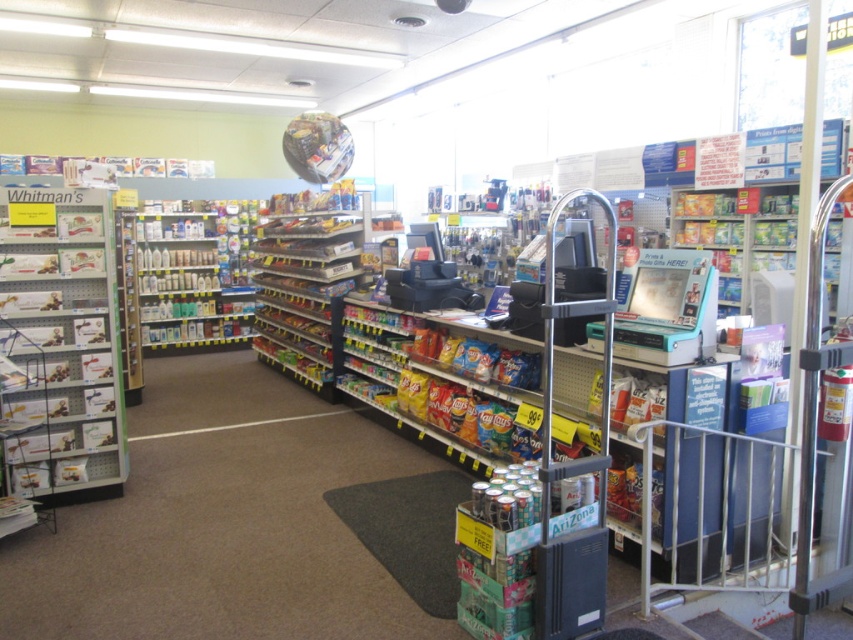
You are a customer in the store and want to place a metallic silver candy at left and a white plastic bottles at left into your shopping basket. Which item will require a wider space in the basket?

The white plastic bottles at left require a wider space in the basket because they have a greater width than the metallic silver candy at left.

You are a customer in the store and want to pick up both the metallic silver candy at left and the white plastic bottles at left. Given that you can only carry one item at a time, which item should you pick first to minimize the distance you walk?

You should pick up the metallic silver candy at left first because it is closer to your starting position than the white plastic bottles at left. Since they are 4.71 meters apart, retrieving the closer item first reduces the total distance walked.